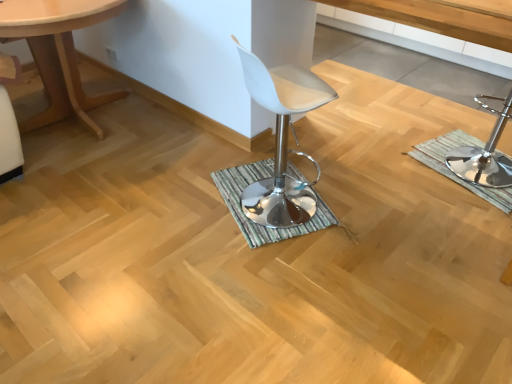
Question: Is green striped bath mat at center, the second bath mat in the right-to-left sequence, oriented away from light wood table at left?

Choices:
 (A) no
 (B) yes

Answer: (A)

Question: Is green striped bath mat at center, the second bath mat in the right-to-left sequence, shorter than light wood table at left?

Choices:
 (A) yes
 (B) no

Answer: (A)

Question: Is green striped bath mat at center, which is counted as the 1th bath mat, starting from the left, to the left of light wood table at left from the viewer's perspective?

Choices:
 (A) no
 (B) yes

Answer: (A)

Question: Is green striped bath mat at center, which is counted as the 1th bath mat, starting from the left, far from light wood table at left?

Choices:
 (A) no
 (B) yes

Answer: (B)

Question: Is green striped bath mat at center, the second bath mat in the right-to-left sequence, positioned behind light wood table at left?

Choices:
 (A) no
 (B) yes

Answer: (B)

Question: Considering the positions of white leather stool at center and white plastic stool at center in the image, is white leather stool at center wider or thinner than white plastic stool at center?

Choices:
 (A) thin
 (B) wide

Answer: (A)

Question: Is point (252, 210) positioned closer to the camera than point (508, 109)?

Choices:
 (A) closer
 (B) farther

Answer: (A)

Question: Looking at the image, does white leather stool at center seem bigger or smaller compared to white plastic stool at center?

Choices:
 (A) big
 (B) small

Answer: (B)

Question: In terms of height, does white leather stool at center look taller or shorter compared to white plastic stool at center?

Choices:
 (A) tall
 (B) short

Answer: (B)

Question: Considering the positions of green striped bath mat at right, the second bath mat when ordered from left to right, and white leather stool at center in the image, is green striped bath mat at right, the second bath mat when ordered from left to right, bigger or smaller than white leather stool at center?

Choices:
 (A) small
 (B) big

Answer: (A)

Question: Is green striped bath mat at right, the second bath mat when ordered from left to right, situated inside white leather stool at center or outside?

Choices:
 (A) inside
 (B) outside

Answer: (B)

Question: From a real-world perspective, is green striped bath mat at right, the second bath mat when ordered from left to right, physically located above or below white leather stool at center?

Choices:
 (A) below
 (B) above

Answer: (A)

Question: Considering their positions, is green striped bath mat at right, the first bath mat viewed from the right, located in front of or behind white leather stool at center?

Choices:
 (A) behind
 (B) front

Answer: (A)

Question: Is light wood table at left situated inside green striped bath mat at center, the second bath mat in the right-to-left sequence, or outside?

Choices:
 (A) outside
 (B) inside

Answer: (A)

Question: Visually, is light wood table at left positioned to the left or to the right of green striped bath mat at center, which is counted as the 1th bath mat, starting from the left?

Choices:
 (A) left
 (B) right

Answer: (A)